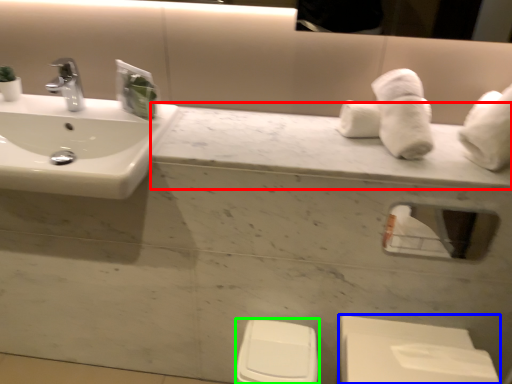
Question: Which object is the closest to the counter top (highlighted by a red box)? Choose among these: porcelain (highlighted by a blue box) or toilet bowl (highlighted by a green box).

Choices:
 (A) porcelain
 (B) toilet bowl

Answer: (A)